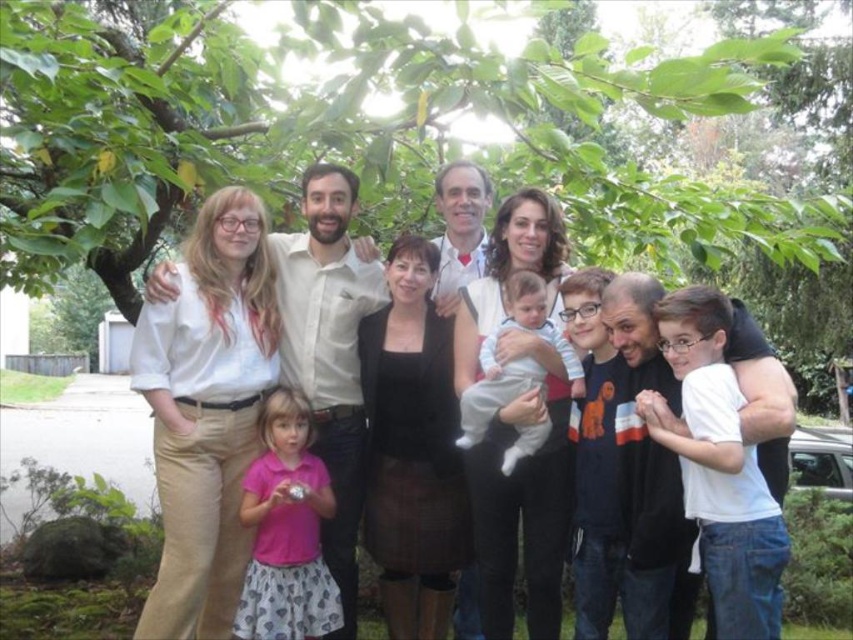
Does matte white shirt at center have a larger size compared to pink fabric dress at lower left?

Indeed, matte white shirt at center has a larger size compared to pink fabric dress at lower left.

Image resolution: width=853 pixels, height=640 pixels. In order to click on matte white shirt at center in this screenshot , I will do `click(329, 342)`.

Image resolution: width=853 pixels, height=640 pixels. I want to click on matte white shirt at center, so click(x=329, y=342).

Between green leafy tree at upper center and matte white shirt at center, which one appears on the left side from the viewer's perspective?

matte white shirt at center is more to the left.

Can you confirm if green leafy tree at upper center is taller than matte white shirt at center?

Incorrect, green leafy tree at upper center's height is not larger of matte white shirt at center's.

Find the location of `green leafy tree at upper center`. green leafy tree at upper center is located at coordinates pyautogui.click(x=346, y=131).

Is pink fabric dress at lower left to the left of light blue cotton onesie at center from the viewer's perspective?

Indeed, pink fabric dress at lower left is positioned on the left side of light blue cotton onesie at center.

Where is `pink fabric dress at lower left`? This screenshot has height=640, width=853. pink fabric dress at lower left is located at coordinates pyautogui.click(x=286, y=531).

Where is `pink fabric dress at lower left`? The height and width of the screenshot is (640, 853). pink fabric dress at lower left is located at coordinates (x=286, y=531).